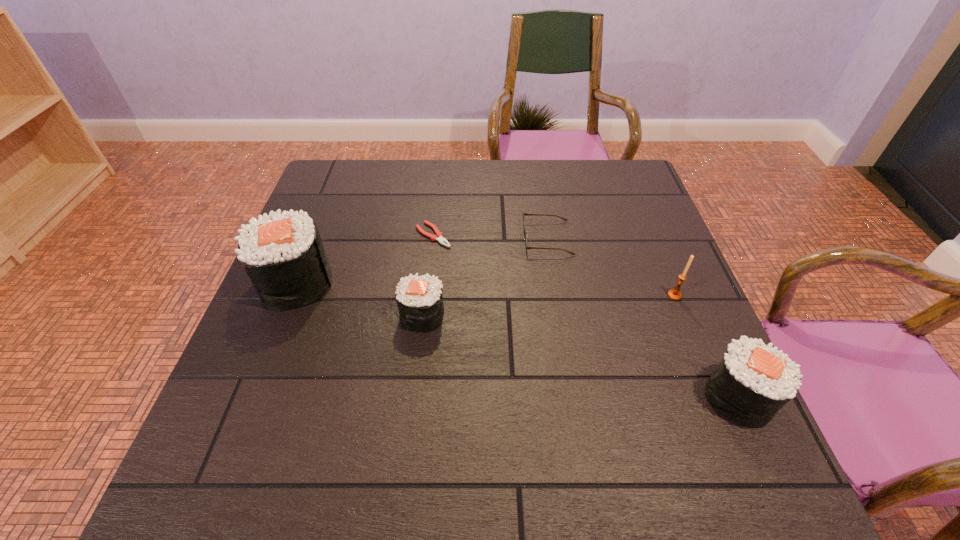
Locate an element on the screen. sushi that stands as the second closest to the shortest sushi is located at coordinates (753, 381).

Locate an element on the screen. The image size is (960, 540). the second closest sushi to the third object from right to left is located at coordinates (753, 381).

Where is `free space that satisfies the following two spatial constraints: 1. on the front side of the fourth tallest object; 2. on the left side of the nearest sushi`? free space that satisfies the following two spatial constraints: 1. on the front side of the fourth tallest object; 2. on the left side of the nearest sushi is located at coordinates (414, 396).

The height and width of the screenshot is (540, 960). In order to click on vacant region that satisfies the following two spatial constraints: 1. on the back side of the rightmost sushi; 2. on the front-facing side of the third object from right to left in this screenshot , I will do `click(667, 238)`.

This screenshot has height=540, width=960. Identify the location of vacant space that satisfies the following two spatial constraints: 1. on the front-facing side of the candle_holder; 2. on the right side of the spectacles. [557, 295].